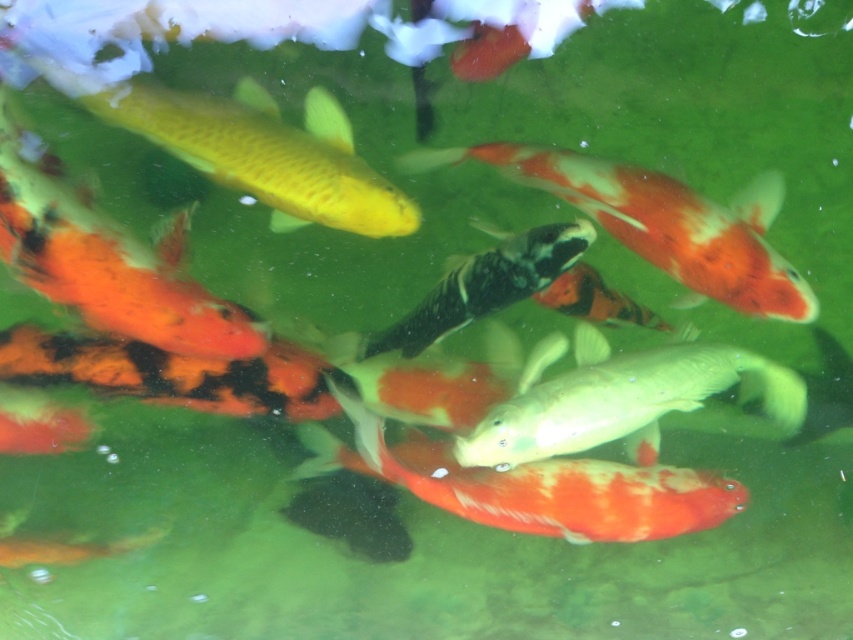
You are a photographer trying to capture a photo of the orange and white speckled goldfish at center and the matte green fish at center. Your camera has a maximum focus range of 6 inches. Can you focus on both fish simultaneously?

The distance between the orange and white speckled goldfish at center and the matte green fish at center is 6.58 inches, which exceeds the camera maximum focus range of 6 inches. Therefore, you cannot focus on both fish at the same time.

You are a photographer trying to capture a clear shot of the shiny gold fish at upper center and the shiny black and white fish at center. Since the water is murky, you need to focus on the taller fish first. Which fish should you focus on?

The shiny gold fish at upper center is much taller than the shiny black and white fish at center, so you should focus on the shiny gold fish at upper center first.

You are standing at the edge of the pond and want to locate the matte green fish at center. According to the coordinates provided, where should you look relative to the center of the image?

The matte green fish at center is located at point coordinates of 0.619 on the x axis and 0.728 on the y axis, so you should look to the right and slightly above the center of the image.